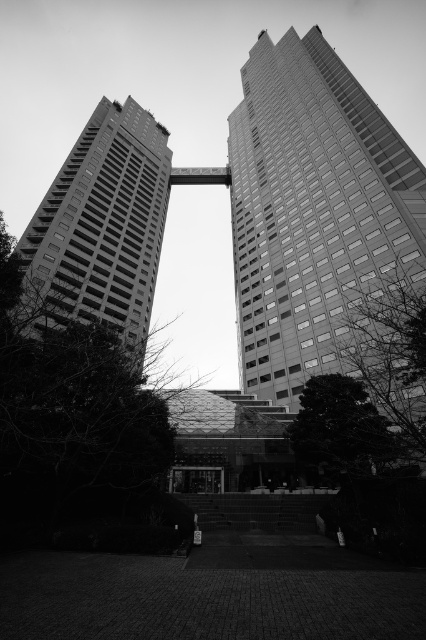
Who is more forward, (345, 189) or (146, 188)?

Point (345, 189) is in front.

Does smooth glass skyscraper at center lie in front of smooth concrete building at left?

No, it is behind smooth concrete building at left.

Image resolution: width=426 pixels, height=640 pixels. What do you see at coordinates (311, 209) in the screenshot?
I see `smooth glass skyscraper at center` at bounding box center [311, 209].

Identify the location of smooth glass skyscraper at center. This screenshot has height=640, width=426. (311, 209).